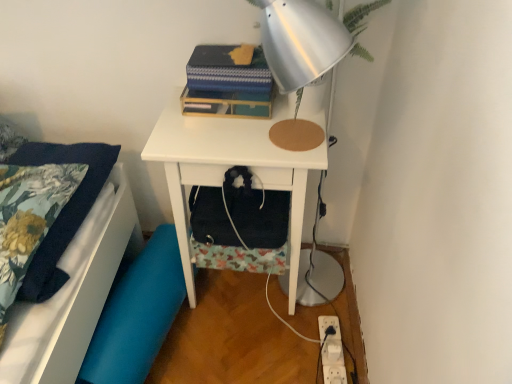
Question: From a real-world perspective, is silver metallic lamp at upper center below floral fabric pillowcase at left?

Choices:
 (A) yes
 (B) no

Answer: (B)

Question: Does silver metallic lamp at upper center have a smaller size compared to floral fabric pillowcase at left?

Choices:
 (A) yes
 (B) no

Answer: (A)

Question: Can you confirm if silver metallic lamp at upper center is positioned to the right of floral fabric pillowcase at left?

Choices:
 (A) no
 (B) yes

Answer: (B)

Question: Does silver metallic lamp at upper center have a lesser width compared to floral fabric pillowcase at left?

Choices:
 (A) yes
 (B) no

Answer: (A)

Question: From the image's perspective, does silver metallic lamp at upper center appear lower than floral fabric pillowcase at left?

Choices:
 (A) yes
 (B) no

Answer: (B)

Question: Considering the positions of floral fabric pillowcase at left and white plastic electric outlet at lower right in the image, is floral fabric pillowcase at left taller or shorter than white plastic electric outlet at lower right?

Choices:
 (A) tall
 (B) short

Answer: (A)

Question: Is point (117, 175) positioned closer to the camera than point (332, 360)?

Choices:
 (A) closer
 (B) farther

Answer: (B)

Question: Based on their positions, is floral fabric pillowcase at left located to the left or right of white plastic electric outlet at lower right?

Choices:
 (A) left
 (B) right

Answer: (A)

Question: Considering their positions, is floral fabric pillowcase at left located in front of or behind white plastic electric outlet at lower right?

Choices:
 (A) behind
 (B) front

Answer: (B)

Question: Is blue fabric swivel chair at lower left to the left or to the right of silver metallic lamp at upper center in the image?

Choices:
 (A) left
 (B) right

Answer: (A)

Question: Considering the positions of point (139, 278) and point (337, 21), is point (139, 278) closer or farther from the camera than point (337, 21)?

Choices:
 (A) farther
 (B) closer

Answer: (A)

Question: In the image, is blue fabric swivel chair at lower left positioned in front of or behind silver metallic lamp at upper center?

Choices:
 (A) behind
 (B) front

Answer: (A)

Question: In terms of width, does blue fabric swivel chair at lower left look wider or thinner when compared to silver metallic lamp at upper center?

Choices:
 (A) wide
 (B) thin

Answer: (B)

Question: In terms of size, does blue fabric swivel chair at lower left appear bigger or smaller than white matte nightstand at center?

Choices:
 (A) big
 (B) small

Answer: (B)

Question: From the image's perspective, is blue fabric swivel chair at lower left located above or below white matte nightstand at center?

Choices:
 (A) above
 (B) below

Answer: (B)